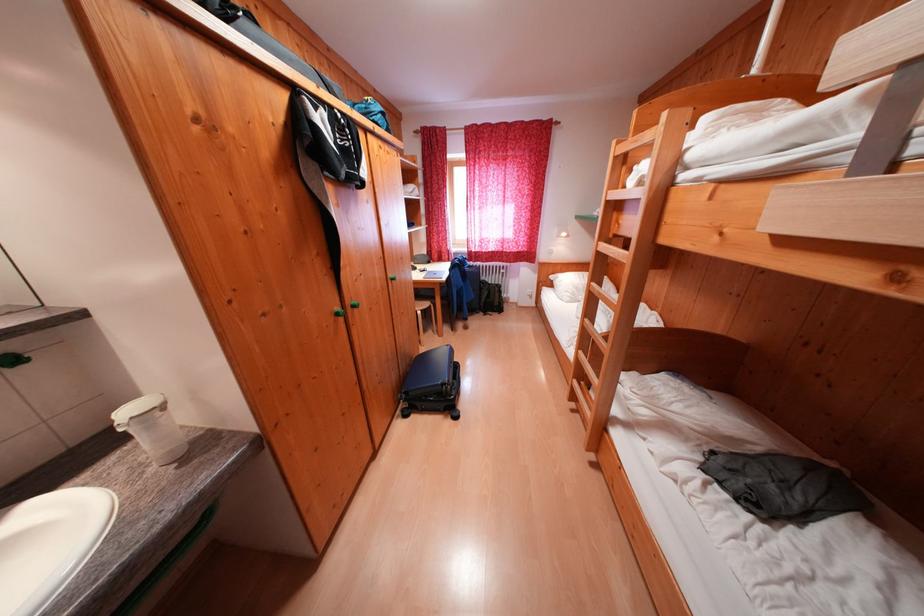
The width and height of the screenshot is (924, 616). Identify the location of chair sitting surface. (422, 315).